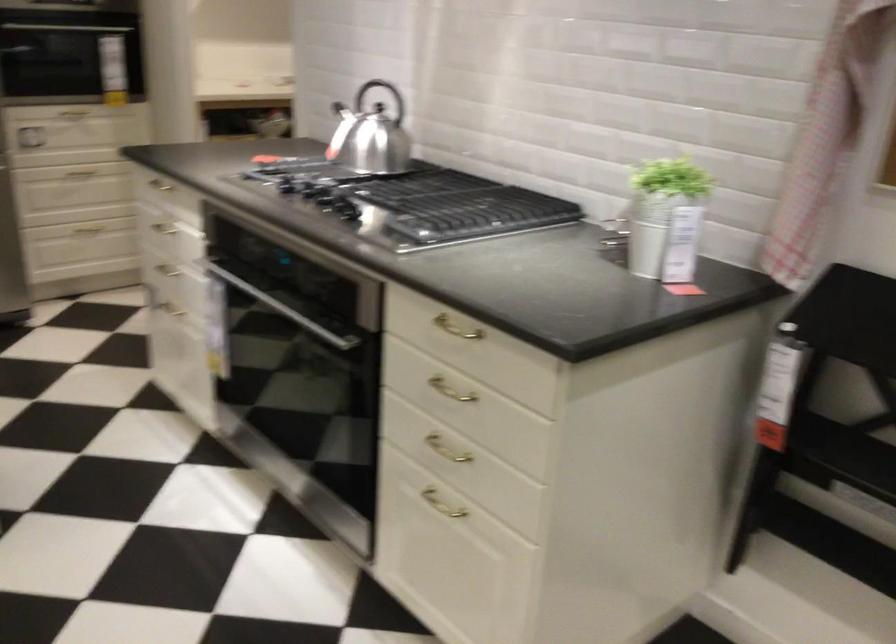
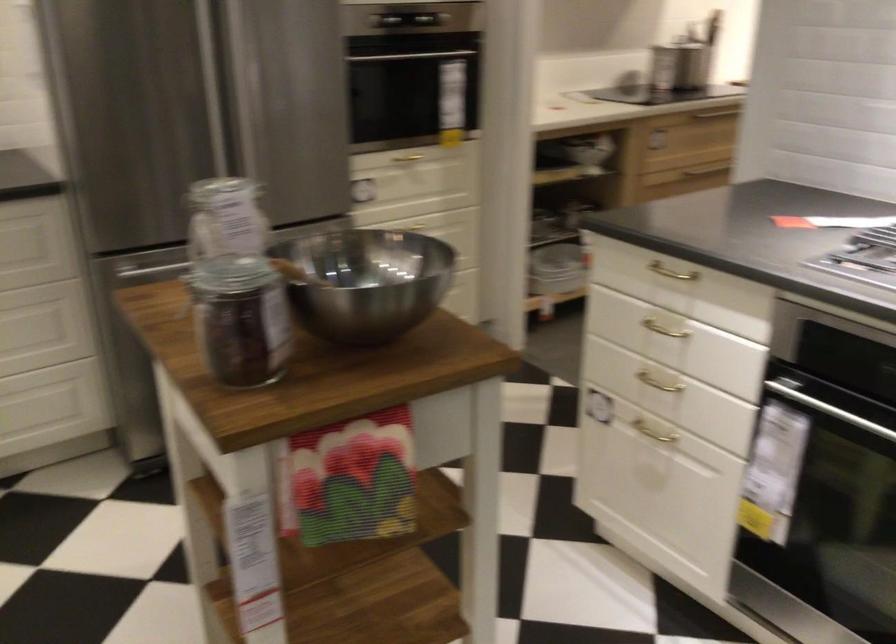
Find the pixel in the second image that matches (176,185) in the first image.

(670, 272)